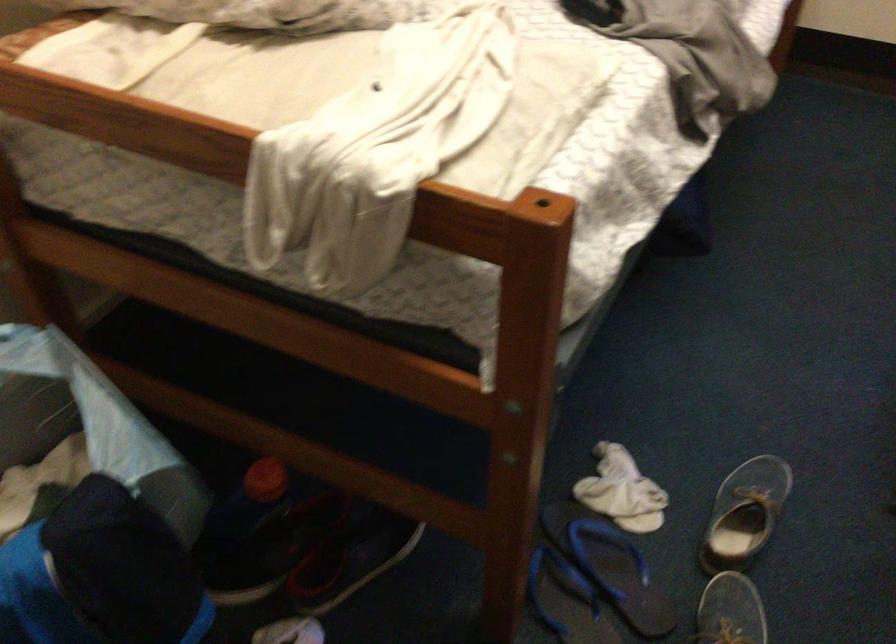
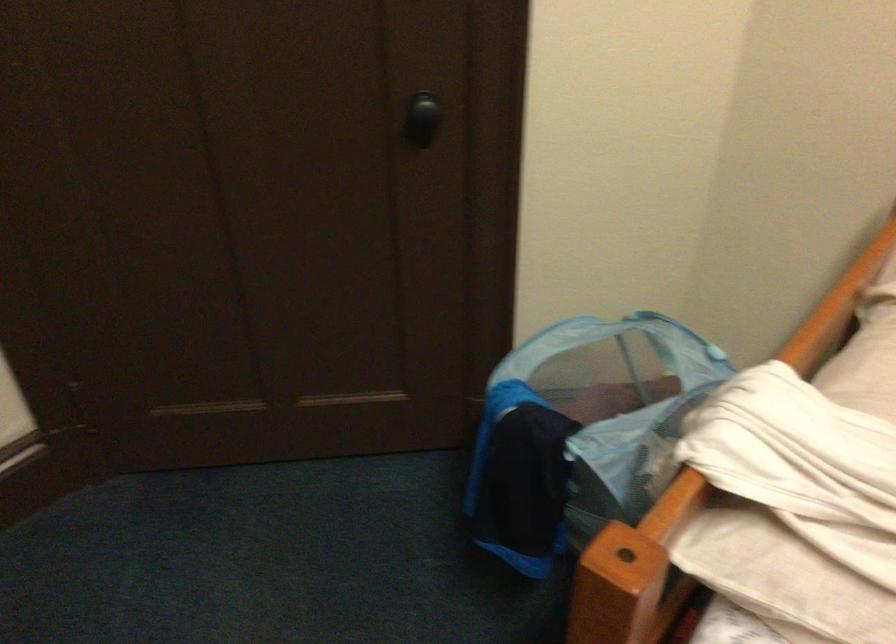
The images are taken continuously from a first-person perspective. In which direction is your viewpoint rotating?

The rotation direction of the camera is left-down.